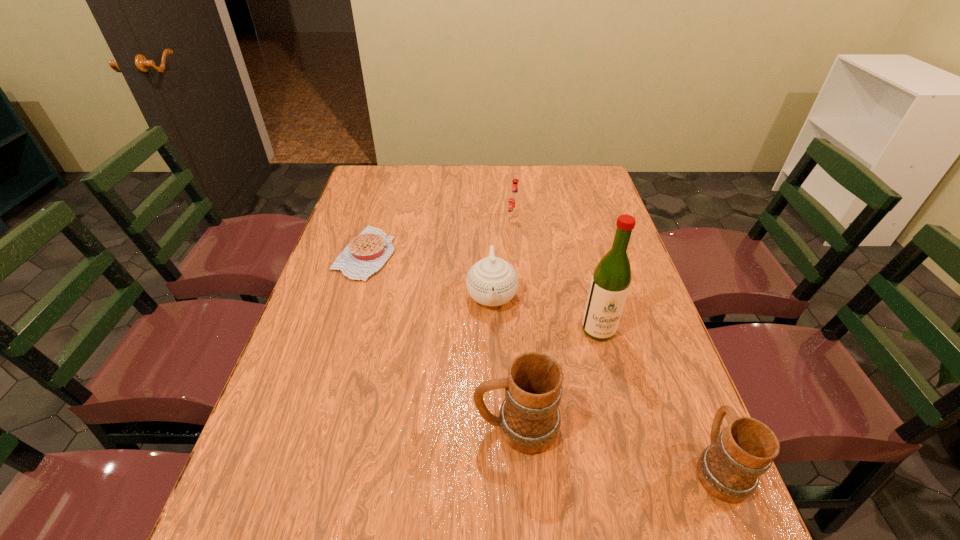
Locate an element on the screen. object present at the left edge is located at coordinates (367, 253).

This screenshot has height=540, width=960. Find the location of `mug located at the right edge`. mug located at the right edge is located at coordinates (729, 469).

Where is `liquor at the right edge`? This screenshot has height=540, width=960. liquor at the right edge is located at coordinates (610, 283).

You are a GUI agent. You are given a task and a screenshot of the screen. Output one action in this format:
    pyautogui.click(x=<x>, y=<y>)
    Task: Click on the object at the near right corner
    The height and width of the screenshot is (540, 960).
    Given the screenshot: What is the action you would take?
    pyautogui.click(x=729, y=469)

I want to click on free space at the far edge of the desktop, so click(476, 192).

In the image, there is a desktop. In order to click on free space at the near edge in this screenshot , I will do `click(463, 485)`.

Where is `blank space at the left edge`? The width and height of the screenshot is (960, 540). blank space at the left edge is located at coordinates (342, 275).

I want to click on vacant region at the right edge of the desktop, so click(x=618, y=349).

Where is `vacant space at the near left corner`? vacant space at the near left corner is located at coordinates (252, 471).

This screenshot has height=540, width=960. Find the location of `vacant region at the near right corner of the desktop`. vacant region at the near right corner of the desktop is located at coordinates (700, 492).